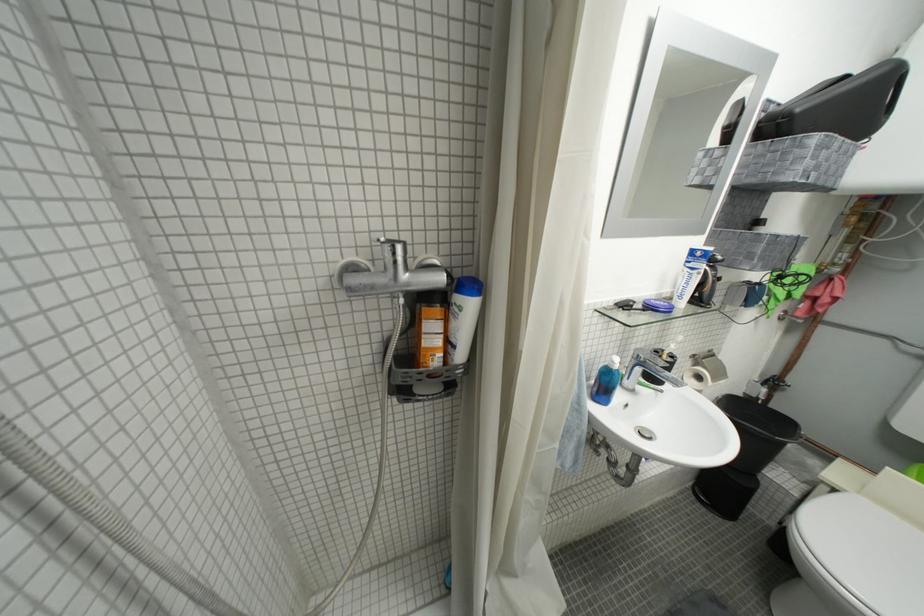
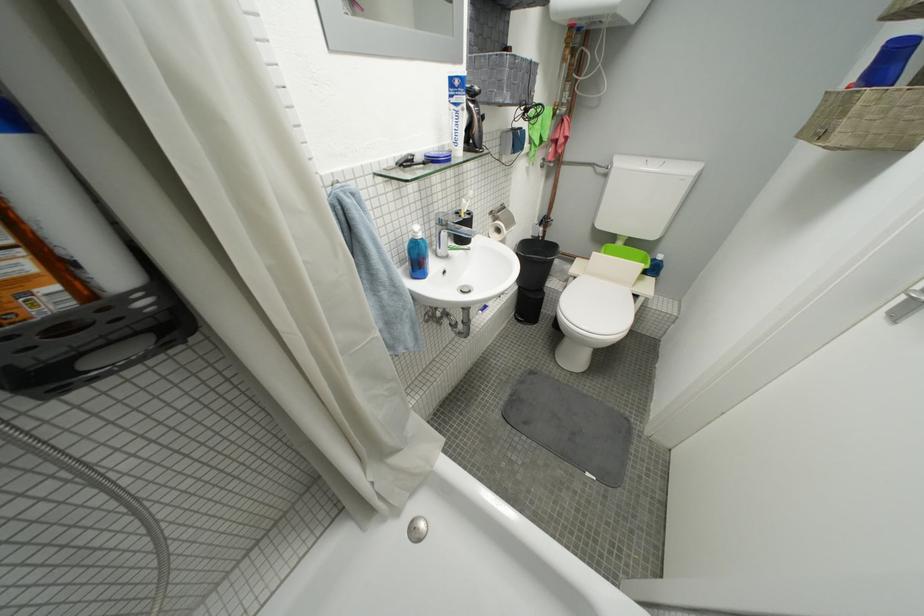
In the second image, find the point that corresponds to (845,493) in the first image.

(584, 281)